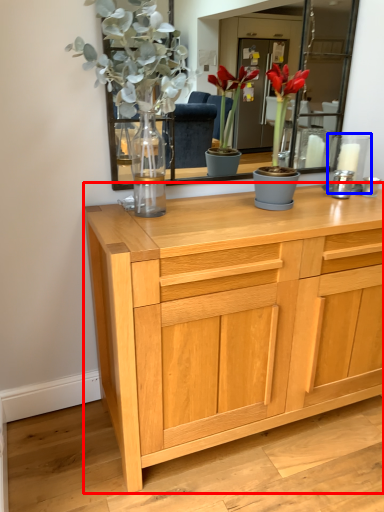
Question: Among these objects, which one is farthest to the camera, chest of drawers (highlighted by a red box) or candle holder (highlighted by a blue box)?

Choices:
 (A) chest of drawers
 (B) candle holder

Answer: (B)